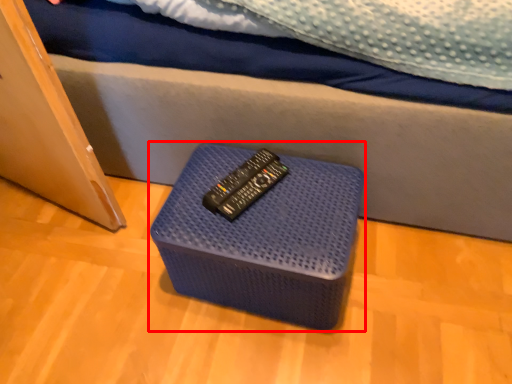
Question: From the image's perspective, where is furniture (annotated by the red box) located in relation to remote in the image?

Choices:
 (A) above
 (B) below

Answer: (B)